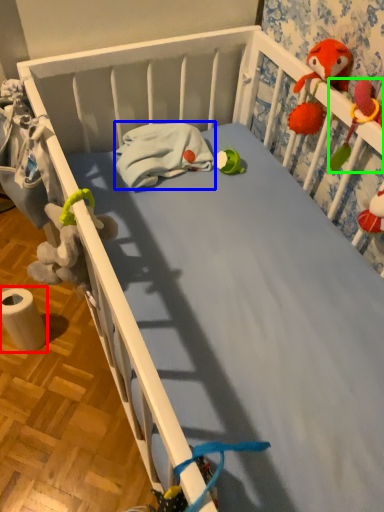
Question: Considering the real-world distances, which object is closest to toilet paper (highlighted by a red box)? material (highlighted by a blue box) or toy (highlighted by a green box).

Choices:
 (A) material
 (B) toy

Answer: (A)